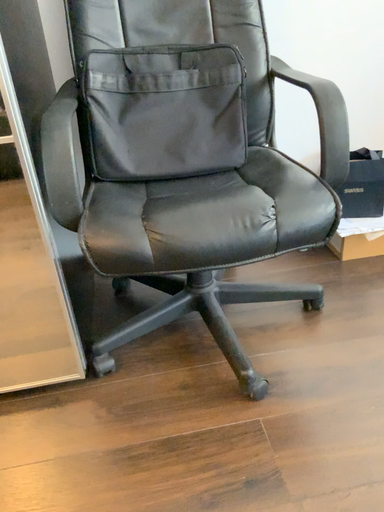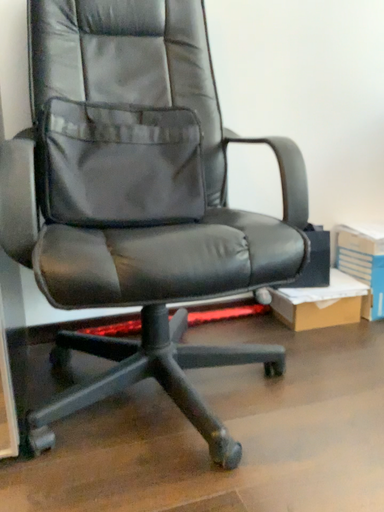
Question: How did the camera likely rotate when shooting the video?

Choices:
 (A) rotated upward
 (B) rotated downward

Answer: (A)